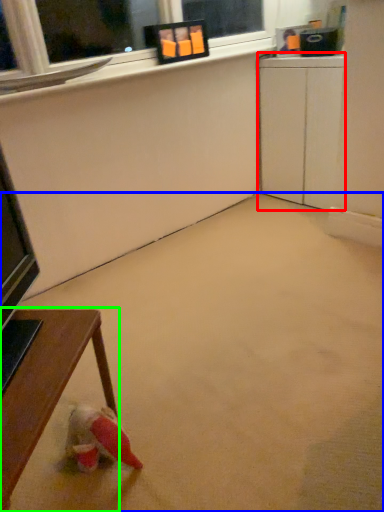
Question: Which is nearer to the computer desk (highlighted by a red box)? concrete (highlighted by a blue box) or table (highlighted by a green box).

Choices:
 (A) concrete
 (B) table

Answer: (A)